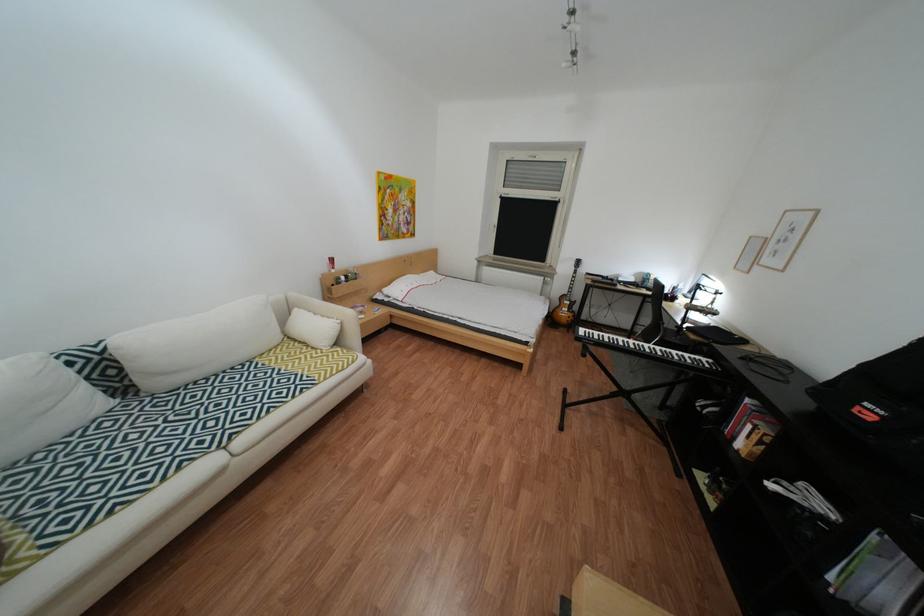
Find where to press the keyboard key. Please return your answer as a coordinate pair (x, y).

(647, 350)